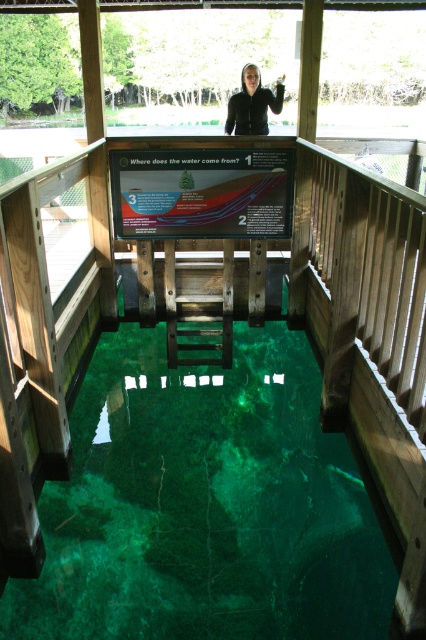
Question: Can you confirm if green translucent water at center is positioned above black matte jacket at upper center?

Choices:
 (A) yes
 (B) no

Answer: (B)

Question: Among these objects, which one is nearest to the camera?

Choices:
 (A) black matte jacket at upper center
 (B) green translucent water at center

Answer: (B)

Question: Is green translucent water at center closer to the viewer compared to black matte jacket at upper center?

Choices:
 (A) yes
 (B) no

Answer: (A)

Question: Observing the image, what is the correct spatial positioning of green translucent water at center in reference to black matte jacket at upper center?

Choices:
 (A) left
 (B) right

Answer: (A)

Question: Which of the following is the farthest from the observer?

Choices:
 (A) (235, 556)
 (B) (259, 83)

Answer: (B)